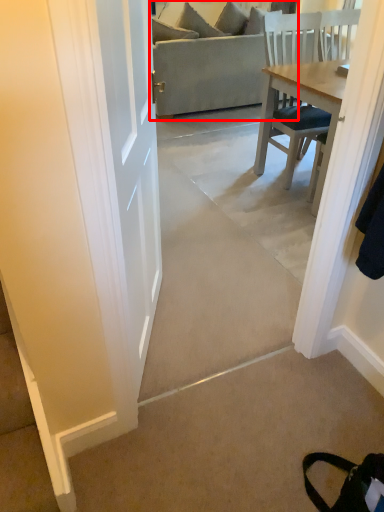
Question: From the image's perspective, what is the correct spatial relationship of studio couch (annotated by the red box) in relation to concrete?

Choices:
 (A) below
 (B) above

Answer: (B)